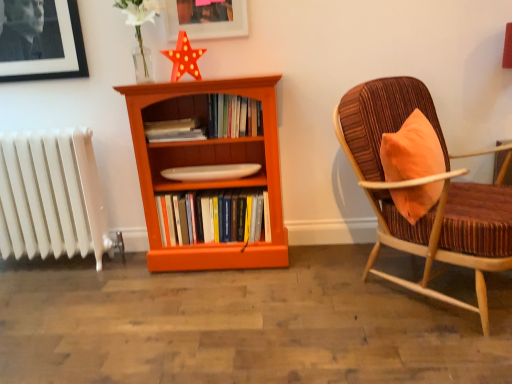
Question: Is the surface of orange wood bookcase at center in direct contact with matte white picture frame at upper center?

Choices:
 (A) yes
 (B) no

Answer: (B)

Question: Considering the relative sizes of orange wood bookcase at center and matte white picture frame at upper center in the image provided, is orange wood bookcase at center bigger than matte white picture frame at upper center?

Choices:
 (A) yes
 (B) no

Answer: (A)

Question: From the image's perspective, is orange wood bookcase at center located above matte white picture frame at upper center?

Choices:
 (A) yes
 (B) no

Answer: (B)

Question: Would you say orange wood bookcase at center is outside matte white picture frame at upper center?

Choices:
 (A) no
 (B) yes

Answer: (B)

Question: From the image's perspective, would you say orange wood bookcase at center is shown under matte white picture frame at upper center?

Choices:
 (A) yes
 (B) no

Answer: (A)

Question: Does orange wood bookcase at center have a lesser width compared to matte white picture frame at upper center?

Choices:
 (A) yes
 (B) no

Answer: (B)

Question: Would you say orange wood bookcase at center is part of matte white picture frame at upper center's contents?

Choices:
 (A) yes
 (B) no

Answer: (B)

Question: Considering the relative positions of matte white picture frame at upper center and orange wood bookcase at center in the image provided, is matte white picture frame at upper center behind orange wood bookcase at center?

Choices:
 (A) yes
 (B) no

Answer: (A)

Question: From the image's perspective, is matte white picture frame at upper center over orange wood bookcase at center?

Choices:
 (A) no
 (B) yes

Answer: (B)

Question: Is matte white picture frame at upper center thinner than orange wood bookcase at center?

Choices:
 (A) yes
 (B) no

Answer: (A)

Question: Is matte white picture frame at upper center at the right side of orange wood bookcase at center?

Choices:
 (A) yes
 (B) no

Answer: (B)

Question: From the image's perspective, is matte white picture frame at upper center located beneath orange wood bookcase at center?

Choices:
 (A) no
 (B) yes

Answer: (A)

Question: Could you tell me if orange wood bookcase at center is turned towards matte orange book at center, which is the 2th book from top to bottom?

Choices:
 (A) yes
 (B) no

Answer: (A)